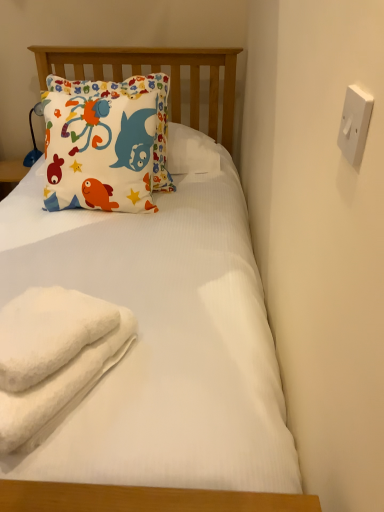
Question: Considering the relative positions of white fluffy beach towel at lower left and white plastic switch at upper right in the image provided, is white fluffy beach towel at lower left to the left or to the right of white plastic switch at upper right?

Choices:
 (A) right
 (B) left

Answer: (B)

Question: Considering the positions of white fluffy beach towel at lower left and white plastic switch at upper right in the image, is white fluffy beach towel at lower left taller or shorter than white plastic switch at upper right?

Choices:
 (A) tall
 (B) short

Answer: (A)

Question: Estimate the real-world distances between objects in this image. Which object is farther from the white fluffy beach towel at lower left?

Choices:
 (A) matte cotton pillow at upper left
 (B) white plastic switch at upper right
 (C) white fluffy towel at lower left

Answer: (A)

Question: Considering the real-world distances, which object is farthest from the white fluffy towel at lower left?

Choices:
 (A) matte cotton pillow at upper left
 (B) white plastic switch at upper right
 (C) white fluffy beach towel at lower left

Answer: (A)